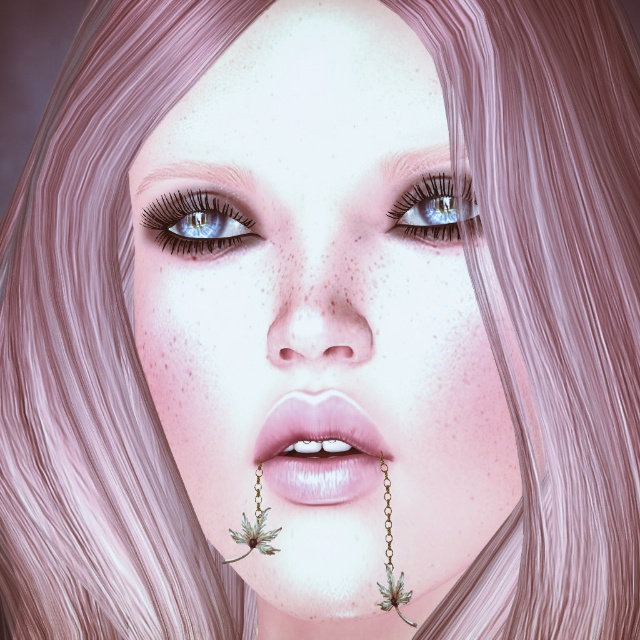
You are a makeup artist preparing for a photoshoot. The subject has matte pink lips at center and a blue glossy eye at upper center. You need to ensure that the distance between these two features is exactly 3 inches for the composition. Is the current distance sufficient?

The matte pink lips at center is 3.09 inches away from blue glossy eye at upper center, which is slightly more than 3 inches. Adjust the positioning to reduce the distance by 0.09 inches to meet the requirement.

Consider the image. You are an artist trying to replicate this portrait. You want to place a highlight on the shiny blue eye at upper left. According to the coordinates provided, where should you place the highlight on the eye?

The highlight should be placed at the coordinates point (196,221) on the shiny blue eye at upper left as specified.